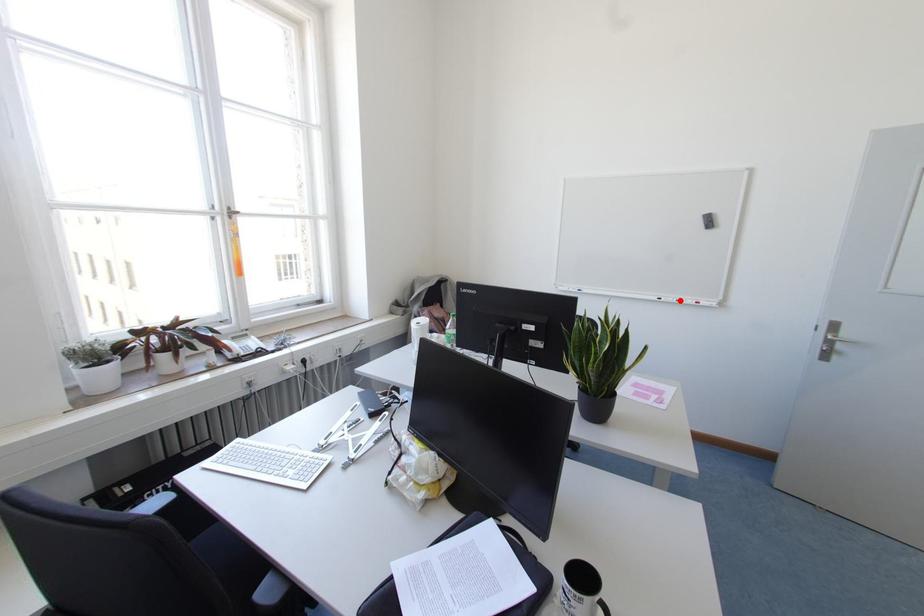
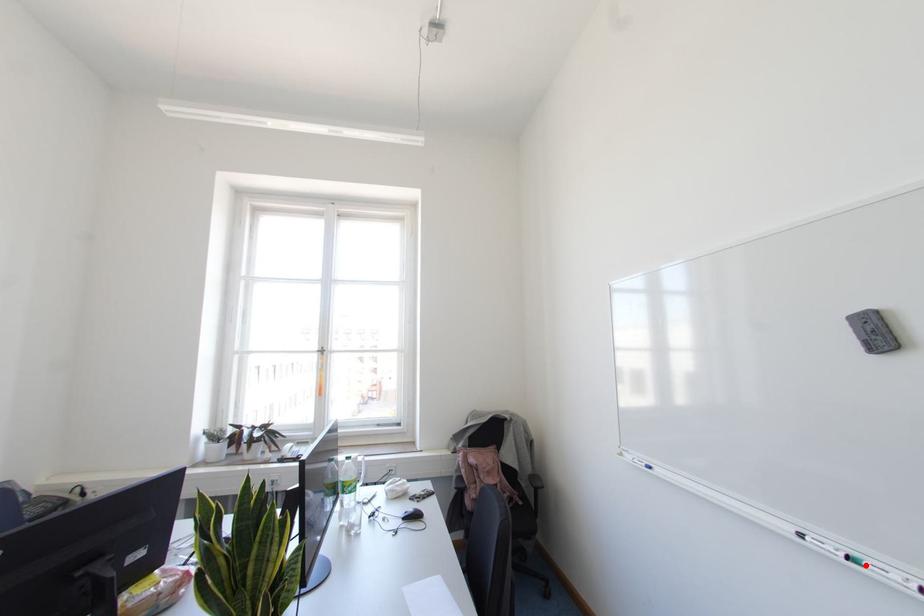
I am providing you with two images of the same scene from different viewpoints. A red point is marked on the first image and another point is marked on the second image. Does the point marked in image1 correspond to the same location as the one in image2?

Yes